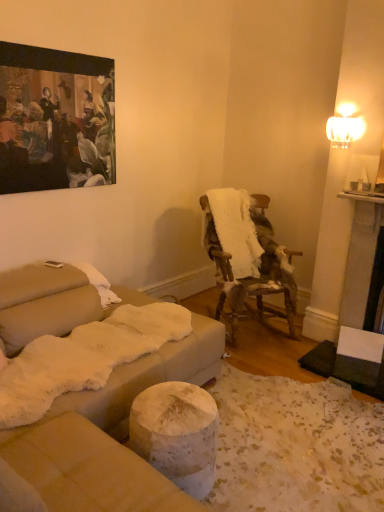
What do you see at coordinates (236, 229) in the screenshot? This screenshot has width=384, height=512. I see `white fluffy blanket at center-right` at bounding box center [236, 229].

Measure the distance between point (35,77) and camera.

Point (35,77) is 8.27 feet from camera.

You are a GUI agent. You are given a task and a screenshot of the screen. Output one action in this format:
    pyautogui.click(x=<x>, y=<y>)
    Task: Click on the white fluffy blanket at center-right
    
    Given the screenshot: What is the action you would take?
    pyautogui.click(x=236, y=229)

Could you tell me if oil painting at upper left is turned towards fur-covered wooden chair at center-right?

No, oil painting at upper left does not turn towards fur-covered wooden chair at center-right.

Are oil painting at upper left and fur-covered wooden chair at center-right located far from each other?

Yes, oil painting at upper left and fur-covered wooden chair at center-right are located far from each other.

Does oil painting at upper left have a smaller size compared to fur-covered wooden chair at center-right?

Correct, oil painting at upper left occupies less space than fur-covered wooden chair at center-right.

Considering the sizes of objects oil painting at upper left and fur-covered wooden chair at center-right in the image provided, who is wider, oil painting at upper left or fur-covered wooden chair at center-right?

fur-covered wooden chair at center-right is wider.

From a real-world perspective, relative to white fluffy blanket at center-right, is oil painting at upper left vertically above or below?

oil painting at upper left is above white fluffy blanket at center-right.

Is point (62, 111) more distant than point (245, 268)?

No, (62, 111) is in front of (245, 268).

Considering the positions of objects oil painting at upper left and white fluffy blanket at center-right in the image provided, who is more to the right, oil painting at upper left or white fluffy blanket at center-right?

white fluffy blanket at center-right.

Considering their positions, is fur-covered wooden chair at center-right located in front of or behind white fluffy blanket at center-right?

fur-covered wooden chair at center-right is positioned closer to the viewer than white fluffy blanket at center-right.

From the image's perspective, between fur-covered wooden chair at center-right and white fluffy blanket at center-right, which one is located above?

white fluffy blanket at center-right is shown above in the image.

Is fur-covered wooden chair at center-right shorter than white fluffy blanket at center-right?

No, fur-covered wooden chair at center-right is not shorter than white fluffy blanket at center-right.

From a real-world perspective, is fur-covered wooden chair at center-right positioned under white fluffy blanket at center-right based on gravity?

Indeed, from a real-world perspective, fur-covered wooden chair at center-right is positioned beneath white fluffy blanket at center-right.

Considering the sizes of objects white fluffy blanket at center-right and oil painting at upper left in the image provided, who is taller, white fluffy blanket at center-right or oil painting at upper left?

Standing taller between the two is oil painting at upper left.

Can you confirm if white fluffy blanket at center-right is thinner than oil painting at upper left?

No, white fluffy blanket at center-right is not thinner than oil painting at upper left.

From the image's perspective, is white fluffy blanket at center-right below oil painting at upper left?

Yes.

Is point (220, 197) in front of point (48, 90)?

No, (220, 197) is further to viewer.

Considering the sizes of fur-covered wooden chair at center-right and oil painting at upper left in the image, is fur-covered wooden chair at center-right taller or shorter than oil painting at upper left?

In the image, fur-covered wooden chair at center-right appears to be taller than oil painting at upper left.

Could you tell me if fur-covered wooden chair at center-right is facing oil painting at upper left?

No.

From the image's perspective, is fur-covered wooden chair at center-right located beneath oil painting at upper left?

Yes.

Is fur-covered wooden chair at center-right next to oil painting at upper left and touching it?

They are not placed beside each other.

Considering the points (204, 238) and (280, 279), which point is behind, point (204, 238) or point (280, 279)?

The point (204, 238) is behind.

Is white fluffy blanket at center-right facing away from fur-covered wooden chair at center-right?

Yes, white fluffy blanket at center-right's orientation is away from fur-covered wooden chair at center-right.

From the picture: What's the angular difference between white fluffy blanket at center-right and fur-covered wooden chair at center-right's facing directions?

There is a 2.82-degree angle between the facing directions of white fluffy blanket at center-right and fur-covered wooden chair at center-right.

Identify the location of picture frame on the left of fur-covered wooden chair at center-right. (55, 119).

In the image, there is a oil painting at upper left. Where is `blanket below it (from the image's perspective)`? The height and width of the screenshot is (512, 384). blanket below it (from the image's perspective) is located at coordinates (236, 229).

Considering their positions, is fur-covered wooden chair at center-right positioned further to white fluffy blanket at center-right than oil painting at upper left?

oil painting at upper left lies further to white fluffy blanket at center-right than the other object.

From the image, which object appears to be farther from fur-covered wooden chair at center-right, white fluffy blanket at center-right or oil painting at upper left?

Based on the image, oil painting at upper left appears to be further to fur-covered wooden chair at center-right.

Considering their positions, is white fluffy blanket at center-right positioned further to oil painting at upper left than fur-covered wooden chair at center-right?

fur-covered wooden chair at center-right is positioned further to the anchor oil painting at upper left.

Considering their positions, is fur-covered wooden chair at center-right positioned closer to oil painting at upper left than white fluffy blanket at center-right?

The object closer to oil painting at upper left is white fluffy blanket at center-right.

Estimate the real-world distances between objects in this image. Which object is further from white fluffy blanket at center-right, oil painting at upper left or fur-covered wooden chair at center-right?

The object further to white fluffy blanket at center-right is oil painting at upper left.

From the picture: When comparing their distances from fur-covered wooden chair at center-right, does oil painting at upper left or white fluffy blanket at center-right seem closer?

white fluffy blanket at center-right.

Where is `blanket situated between oil painting at upper left and fur-covered wooden chair at center-right from left to right`? blanket situated between oil painting at upper left and fur-covered wooden chair at center-right from left to right is located at coordinates (236, 229).